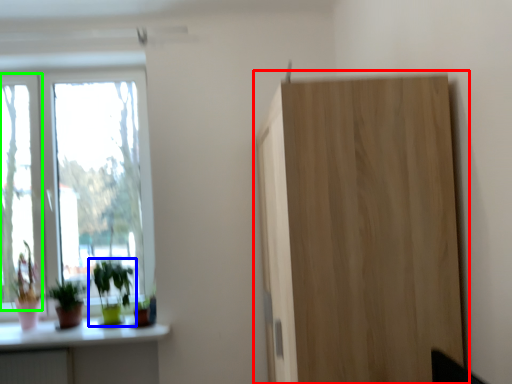
Question: Estimate the real-world distances between objects in this image. Which object is closer to cupboard (highlighted by a red box), houseplant (highlighted by a blue box) or window (highlighted by a green box)?

Choices:
 (A) houseplant
 (B) window

Answer: (A)